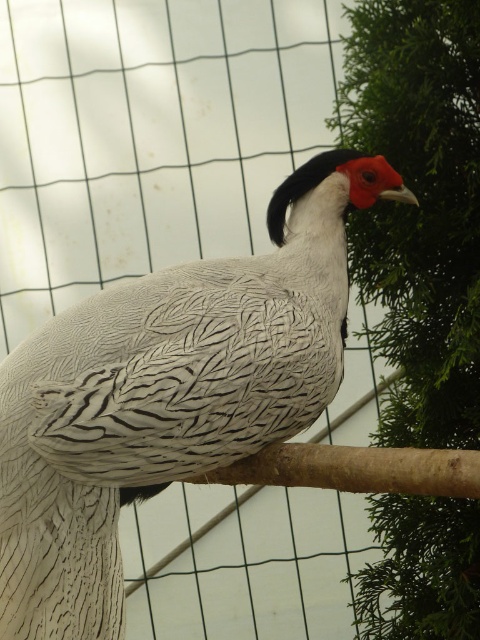
Question: Does white feathered bird at center appear over green textured tree at right?

Choices:
 (A) yes
 (B) no

Answer: (B)

Question: Is white feathered bird at center below green textured tree at right?

Choices:
 (A) yes
 (B) no

Answer: (A)

Question: Does white feathered bird at center have a greater width compared to green textured tree at right?

Choices:
 (A) yes
 (B) no

Answer: (A)

Question: Which of the following is the closest to the observer?

Choices:
 (A) white feathered bird at center
 (B) green textured tree at right

Answer: (A)